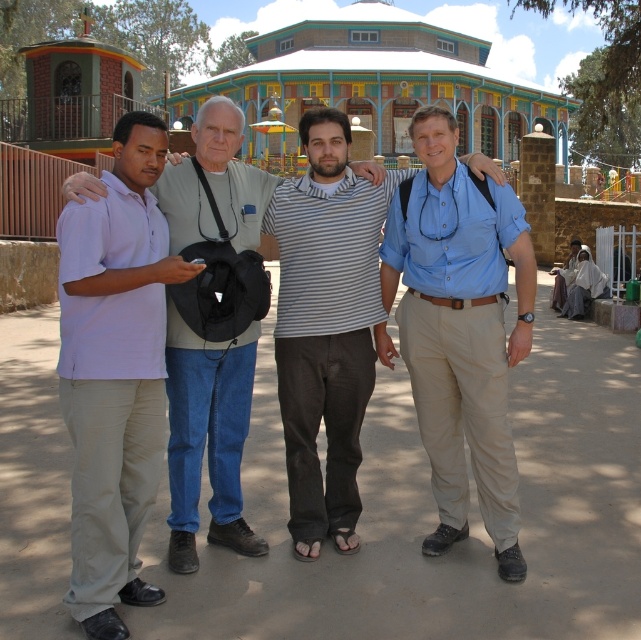
Question: Is blue cotton shirt at center to the left of striped cotton shirt at center from the viewer's perspective?

Choices:
 (A) no
 (B) yes

Answer: (A)

Question: Where is light purple cotton polo shirt at left located in relation to striped cotton shirt at center in the image?

Choices:
 (A) left
 (B) right

Answer: (A)

Question: Does blue cotton shirt at center appear over striped cotton shirt at center?

Choices:
 (A) no
 (B) yes

Answer: (A)

Question: Which of the following is the farthest from the observer?

Choices:
 (A) matte gray shirt at center
 (B) blue cotton shirt at center
 (C) light purple cotton polo shirt at left
 (D) striped cotton shirt at center

Answer: (D)

Question: Which point is closer to the camera?

Choices:
 (A) light purple cotton polo shirt at left
 (B) striped cotton shirt at center

Answer: (A)

Question: Which point is farther to the camera?

Choices:
 (A) striped cotton shirt at center
 (B) light purple cotton polo shirt at left
 (C) blue cotton shirt at center

Answer: (A)